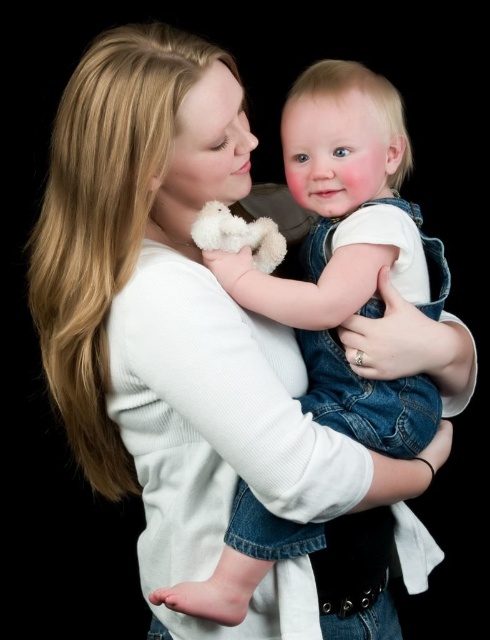
Question: Observing the image, what is the correct spatial positioning of denim overalls at center in reference to white plush teddy bear at center?

Choices:
 (A) below
 (B) above

Answer: (A)

Question: Which point is farther to the camera?

Choices:
 (A) (334, 317)
 (B) (274, 250)

Answer: (B)

Question: Does denim overalls at center have a greater width compared to white plush teddy bear at center?

Choices:
 (A) no
 (B) yes

Answer: (B)

Question: Can you confirm if denim overalls at center is smaller than white plush teddy bear at center?

Choices:
 (A) no
 (B) yes

Answer: (A)